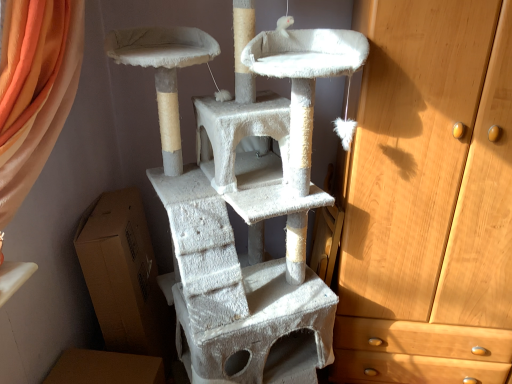
Question: Is brown cardboard box at lower left facing away from white textured cat tree at center?

Choices:
 (A) no
 (B) yes

Answer: (B)

Question: Considering the relative sizes of brown cardboard box at lower left and white textured cat tree at center in the image provided, is brown cardboard box at lower left taller than white textured cat tree at center?

Choices:
 (A) yes
 (B) no

Answer: (B)

Question: Is brown cardboard box at lower left at the right side of white textured cat tree at center?

Choices:
 (A) no
 (B) yes

Answer: (A)

Question: Can white textured cat tree at center be found inside brown cardboard box at lower left?

Choices:
 (A) no
 (B) yes

Answer: (A)

Question: Is brown cardboard box at lower left at the left side of white textured cat tree at center?

Choices:
 (A) yes
 (B) no

Answer: (A)

Question: Are brown cardboard box at lower left and white textured cat tree at center far apart?

Choices:
 (A) no
 (B) yes

Answer: (A)

Question: Is white textured cat tree at center to the left of light brown wooden chest of drawers at right from the viewer's perspective?

Choices:
 (A) yes
 (B) no

Answer: (A)

Question: Is white textured cat tree at center turned away from light brown wooden chest of drawers at right?

Choices:
 (A) yes
 (B) no

Answer: (B)

Question: Considering the relative sizes of white textured cat tree at center and light brown wooden chest of drawers at right in the image provided, is white textured cat tree at center shorter than light brown wooden chest of drawers at right?

Choices:
 (A) yes
 (B) no

Answer: (A)

Question: From the image's perspective, is white textured cat tree at center located beneath light brown wooden chest of drawers at right?

Choices:
 (A) yes
 (B) no

Answer: (A)

Question: From a real-world perspective, is white textured cat tree at center on light brown wooden chest of drawers at right?

Choices:
 (A) no
 (B) yes

Answer: (A)

Question: Does white textured cat tree at center lie behind light brown wooden chest of drawers at right?

Choices:
 (A) no
 (B) yes

Answer: (A)

Question: From the image's perspective, is white textured cat tree at center above brown cardboard box at lower left?

Choices:
 (A) yes
 (B) no

Answer: (A)